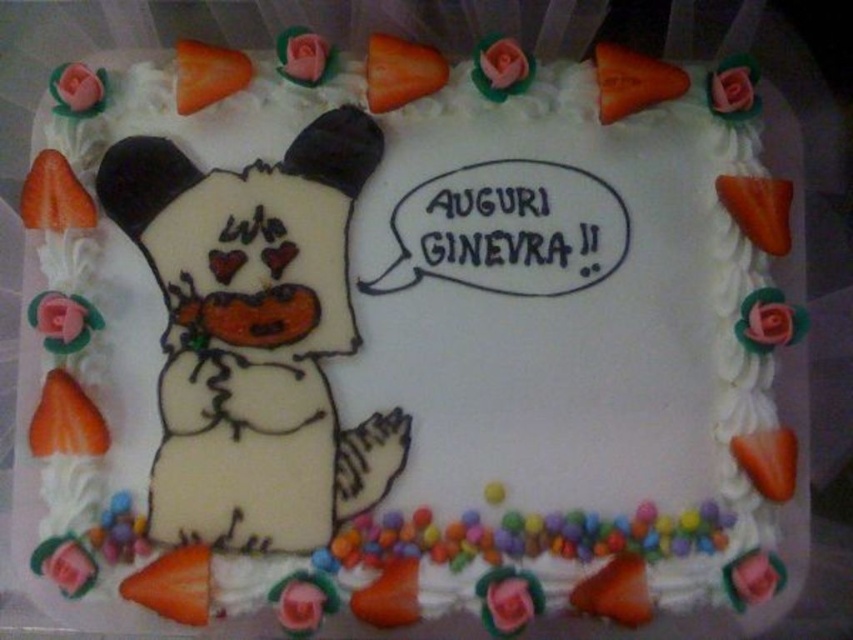
This screenshot has height=640, width=853. Find the location of `orange matte carrot at lower left`. orange matte carrot at lower left is located at coordinates (173, 584).

Who is higher up, orange matte carrot at lower left or orange matte carrot at upper left?

orange matte carrot at upper left is higher up.

Measure the distance between orange matte carrot at lower left and camera.

orange matte carrot at lower left is 3.86 feet away from camera.

Identify the location of orange matte carrot at lower left. (173, 584).

Does white fondant snowman at center appear under orange matte carrot at lower left?

Actually, white fondant snowman at center is above orange matte carrot at lower left.

What are the coordinates of `white fondant snowman at center` in the screenshot? It's located at tap(254, 337).

Based on the photo, who is more forward, (409, 420) or (244, 56)?

Point (409, 420) is in front.

Which is behind, point (328, 184) or point (219, 76)?

The point (328, 184) is behind.

Identify the location of white fondant snowman at center. click(x=254, y=337).